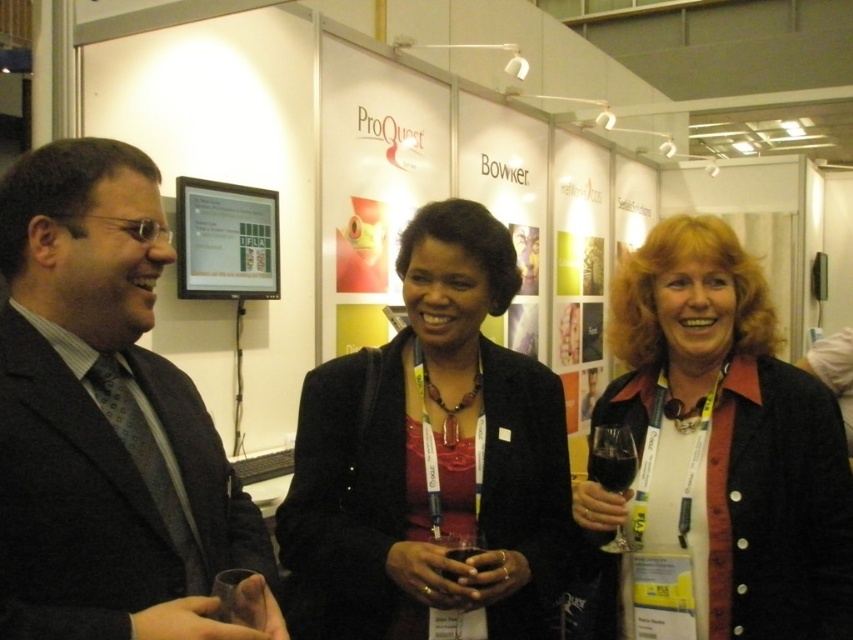
You are standing at the point with coordinates point (453, 556) and want to move towards the point with coordinates point (798, 451). Which direction should you move to get closer?

To move from point (453, 556) towards point (798, 451), you should move upwards and to the left since point (798, 451) is located above and to the left of point (453, 556).

From the picture: You are standing in front of the ProQuest and Bowker backdrop at the event. There are two points marked on the backdrop at coordinates point (x=714, y=326) and point (x=621, y=445). If you want to place a sticker on the closer point to you, which coordinate should you choose?

Point (x=621, y=445) is closer to you than point (x=714, y=326), so you should choose point (x=621, y=445) to place the sticker.